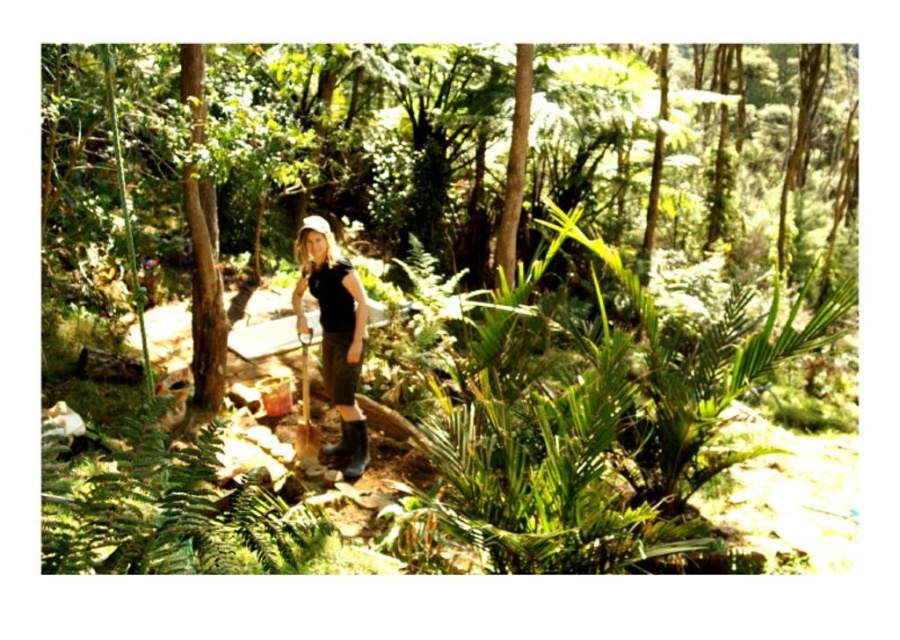
Does point (653, 349) come closer to viewer compared to point (203, 250)?

That is True.

Which is in front, point (799, 307) or point (203, 134)?

Point (203, 134)

Is point (436, 401) farther from viewer compared to point (199, 179)?

That is True.

At what (x,y) coordinates should I click in order to perform the action: click on green leafy fern at center. Please return your answer as a coordinate pair (x, y). The width and height of the screenshot is (900, 640). Looking at the image, I should click on (594, 426).

Is point (662, 506) behind point (356, 385)?

No, (662, 506) is closer to viewer.

Based on the photo, is green leafy fern at center smaller than matte black shirt at center?

No, green leafy fern at center is not smaller than matte black shirt at center.

Is point (493, 461) positioned behind point (300, 232)?

No, (493, 461) is closer to viewer.

Locate an element on the screen. green leafy fern at center is located at coordinates 594,426.

Where is `matte black shirt at center`? This screenshot has height=640, width=900. matte black shirt at center is located at coordinates (334, 332).

Where is `matte black shirt at center`? matte black shirt at center is located at coordinates (334, 332).